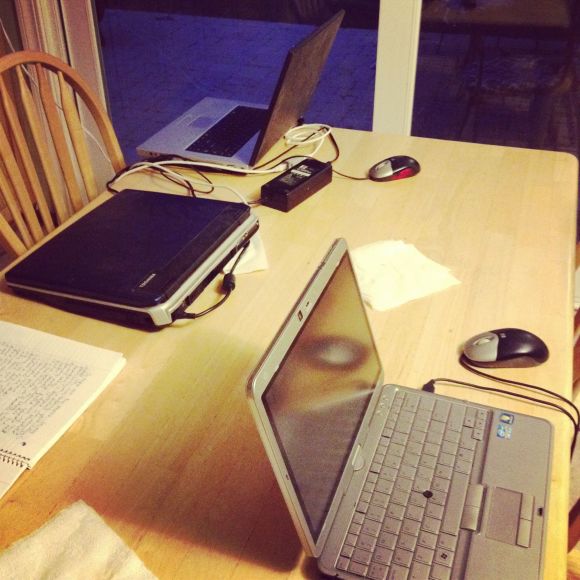
In order to click on screen of laptop in this screenshot , I will do `click(315, 351)`.